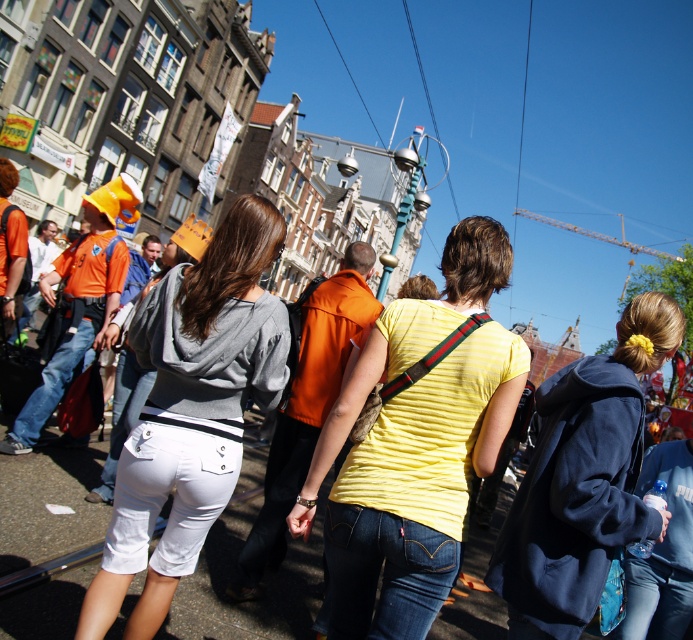
Question: Can you confirm if gray hoodie at center is bigger than dark blue sweatshirt at center-right?

Choices:
 (A) yes
 (B) no

Answer: (B)

Question: Which object is the farthest from the yellow striped shirt at center?

Choices:
 (A) gray hoodie at center
 (B) dark blue sweatshirt at center-right

Answer: (A)

Question: Which of the following is the closest to the observer?

Choices:
 (A) (188, 432)
 (B) (520, 620)
 (C) (432, 513)

Answer: (B)

Question: Which point is closer to the camera taking this photo?

Choices:
 (A) (331, 586)
 (B) (605, 456)
 (C) (134, 488)

Answer: (B)

Question: Is yellow striped shirt at center wider than dark blue sweatshirt at center-right?

Choices:
 (A) no
 (B) yes

Answer: (B)

Question: Does yellow striped shirt at center lie in front of gray hoodie at center?

Choices:
 (A) no
 (B) yes

Answer: (A)